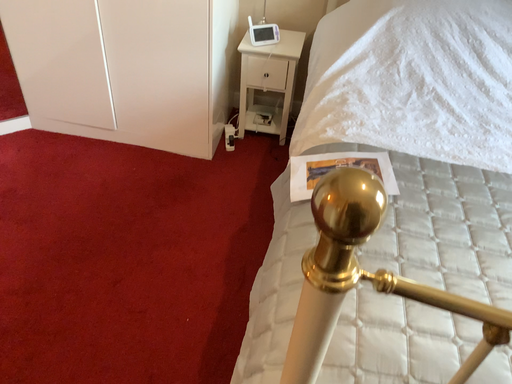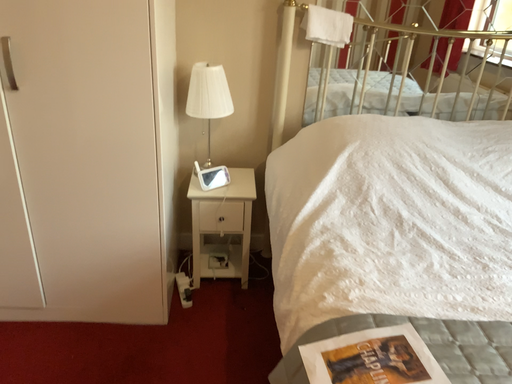
Question: How did the camera likely rotate when shooting the video?

Choices:
 (A) rotated downward
 (B) rotated upward

Answer: (B)